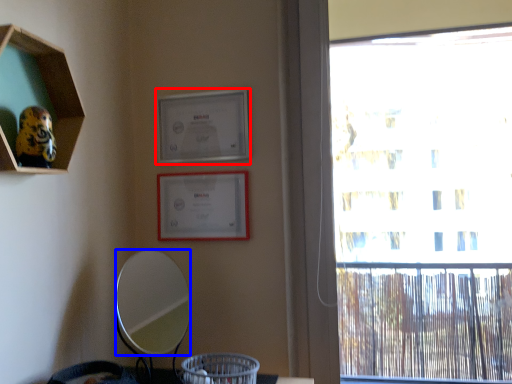
Question: Which object is closer to the camera taking this photo, picture frame (highlighted by a red box) or mirror (highlighted by a blue box)?

Choices:
 (A) picture frame
 (B) mirror

Answer: (B)